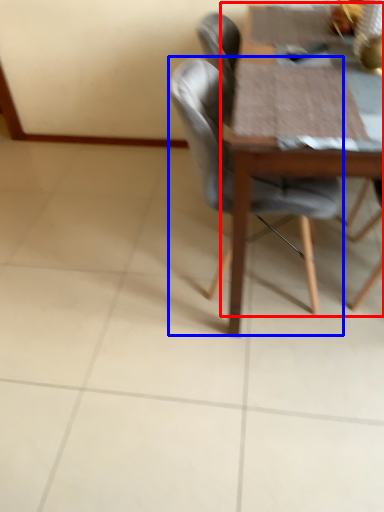
Question: Which point is closer to the camera, round table (highlighted by a red box) or chair (highlighted by a blue box)?

Choices:
 (A) round table
 (B) chair

Answer: (A)